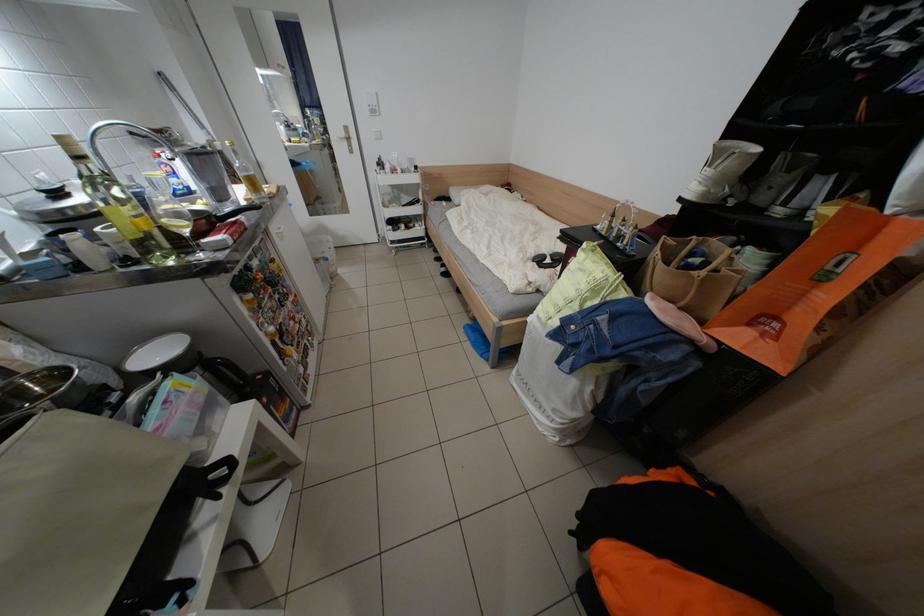
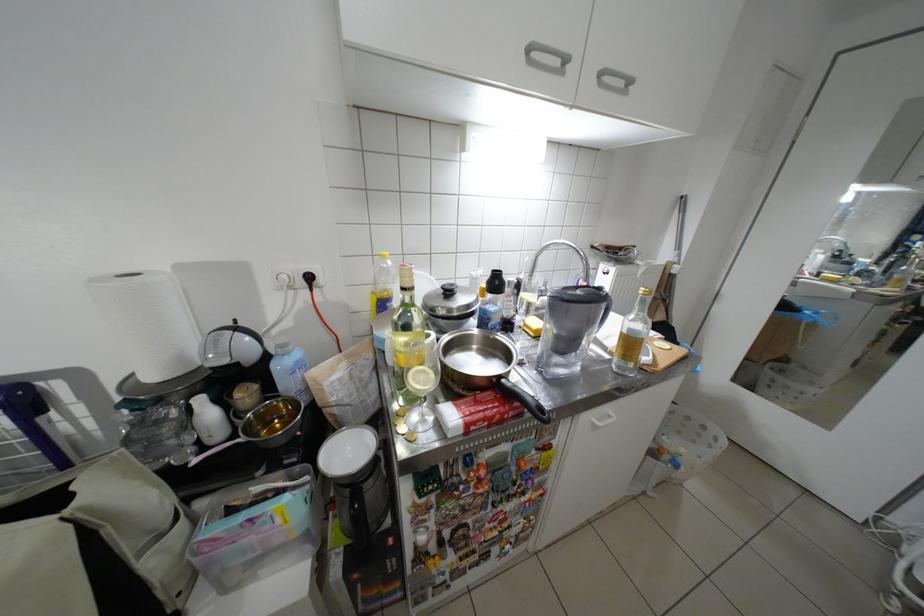
Question: The camera is either moving clockwise (left) or counter-clockwise (right) around the object. The first image is from the beginning of the video and the second image is from the end. Is the camera moving left or right when shooting the video?

Choices:
 (A) Left
 (B) Right

Answer: (B)